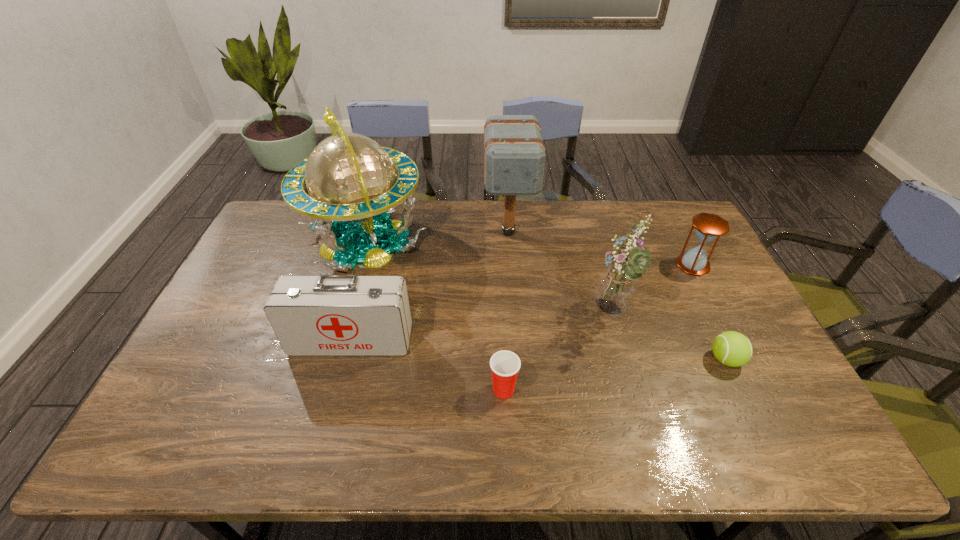
This screenshot has width=960, height=540. What are the coordinates of `vacant point located between the shortest object and the nearest object` in the screenshot? It's located at (614, 375).

Locate an element on the screen. The width and height of the screenshot is (960, 540). free spot between the mallet and the first-aid kit is located at coordinates (430, 286).

Identify the location of free space between the globe and the mallet. This screenshot has height=540, width=960. (437, 236).

You are a GUI agent. You are given a task and a screenshot of the screen. Output one action in this format:
    pyautogui.click(x=<x>, y=<y>)
    Task: Click on the vacant space that is in between the tennis ball and the Dixie cup
    This screenshot has height=540, width=960.
    Given the screenshot: What is the action you would take?
    pyautogui.click(x=614, y=375)

At what (x,y) coordinates should I click in order to perform the action: click on free space between the mallet and the hourglass. Please return your answer as a coordinate pair (x, y). The width and height of the screenshot is (960, 540). Looking at the image, I should click on (600, 248).

Identify the location of vacant space that's between the mallet and the fourth shortest object. The width and height of the screenshot is (960, 540). (430, 286).

Identify which object is the fourth closest to the tennis ball. Please provide its 2D coordinates. Your answer should be formatted as a tuple, i.e. [(x, y)], where the tuple contains the x and y coordinates of a point satisfying the conditions above.

[(514, 154)]

Locate which object ranks in proximity to the tennis ball. Please provide its 2D coordinates. Your answer should be formatted as a tuple, i.e. [(x, y)], where the tuple contains the x and y coordinates of a point satisfying the conditions above.

[(615, 289)]

Locate an element on the screen. This screenshot has width=960, height=540. vacant space that satisfies the following two spatial constraints: 1. on the front-facing side of the bouquet; 2. on the back side of the shortest object is located at coordinates (624, 360).

Identify the location of free space that satisfies the following two spatial constraints: 1. on the front-facing side of the nearest object; 2. on the left side of the first-aid kit. (338, 389).